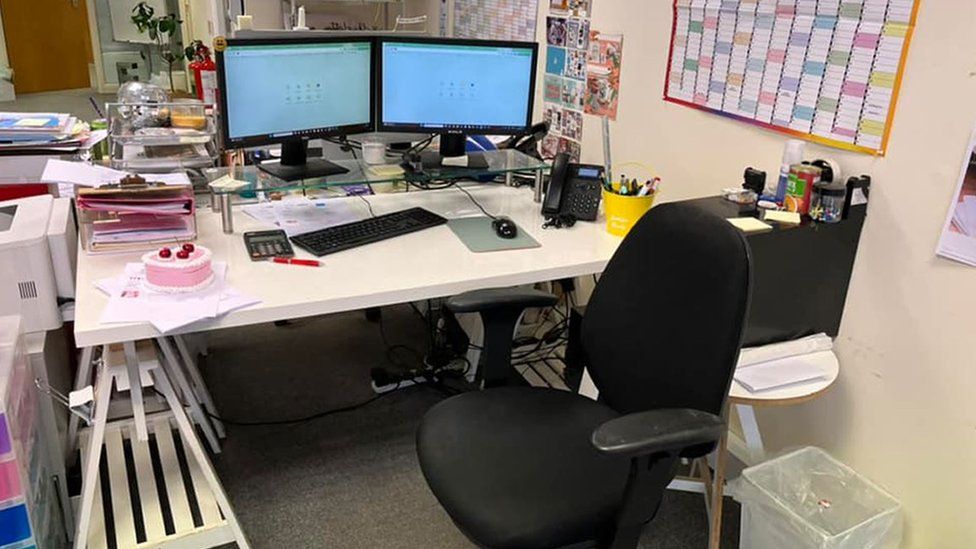
At what (x,y) coordinates should I click in order to perform the action: click on office chair. Please return your answer as a coordinate pair (x, y). Looking at the image, I should click on (551, 458).